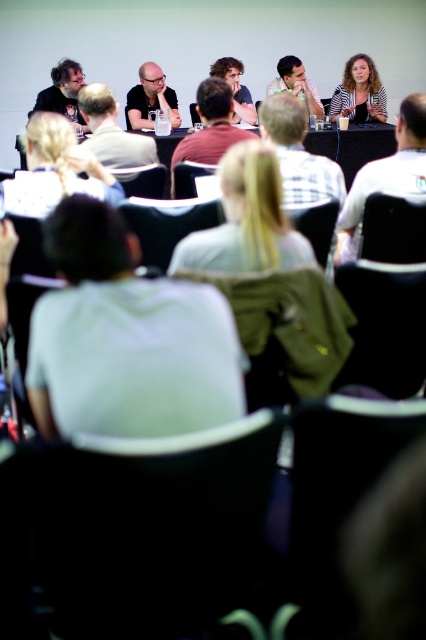
Question: Does light brown hair at center come behind light beige shirt at center?

Choices:
 (A) yes
 (B) no

Answer: (B)

Question: Which point is farther to the camera?

Choices:
 (A) (365, 88)
 (B) (249, 108)
 (C) (9, 204)
 (D) (83, 113)

Answer: (A)

Question: Which object is farther from the camera taking this photo?

Choices:
 (A) light gray shirt at center
 (B) white shirt at upper center
 (C) white checkered shirt at center
 (D) light brown hair at center

Answer: (A)

Question: Which object is farther from the camera taking this photo?

Choices:
 (A) matte black shirt at center
 (B) light gray shirt at center
 (C) light brown hair at center

Answer: (A)

Question: Can you confirm if white shirt at upper center is positioned to the right of matte black laptop at center?

Choices:
 (A) yes
 (B) no

Answer: (A)

Question: Considering the relative positions of light gray shirt at center and matte black laptop at center in the image provided, where is light gray shirt at center located with respect to matte black laptop at center?

Choices:
 (A) above
 (B) below

Answer: (B)